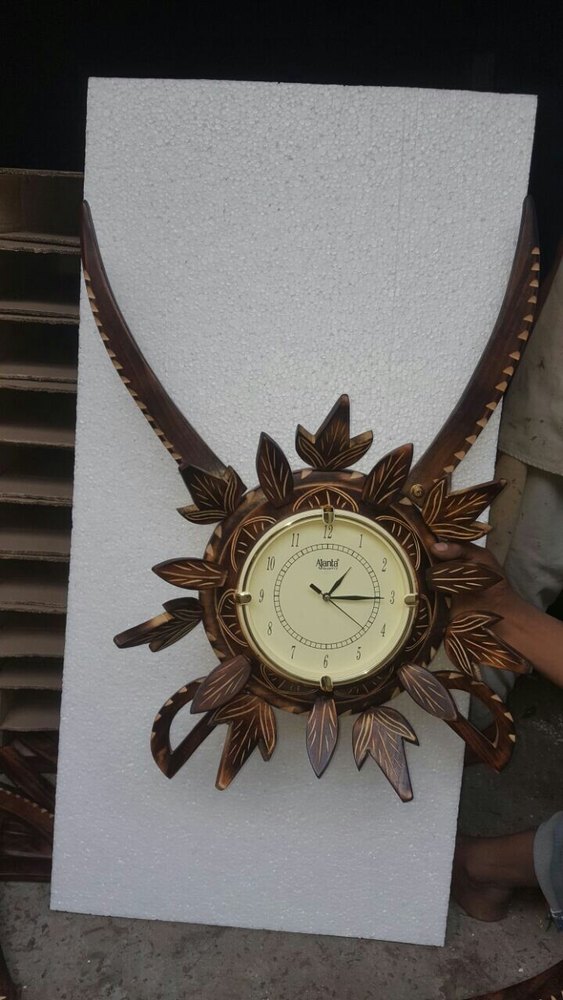
Locate an element on the screen. This screenshot has height=1000, width=563. wood carving around clock is located at coordinates (218, 468), (396, 734).